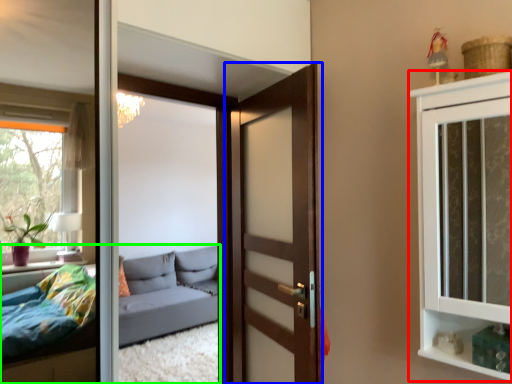
Question: Based on their relative distances, which object is farther from cabinetry (highlighted by a red box)? Choose from door (highlighted by a blue box) and studio couch (highlighted by a green box).

Choices:
 (A) door
 (B) studio couch

Answer: (B)